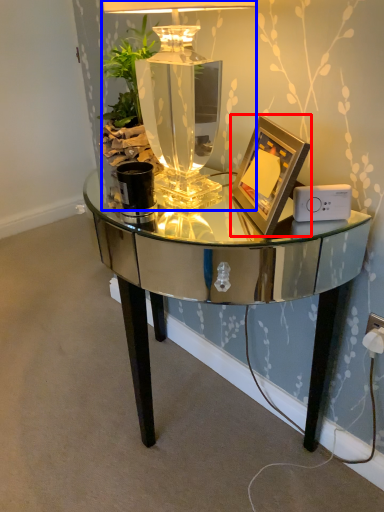
Question: Which point is further to the camera, picture frame (highlighted by a red box) or table lamp (highlighted by a blue box)?

Choices:
 (A) picture frame
 (B) table lamp

Answer: (A)